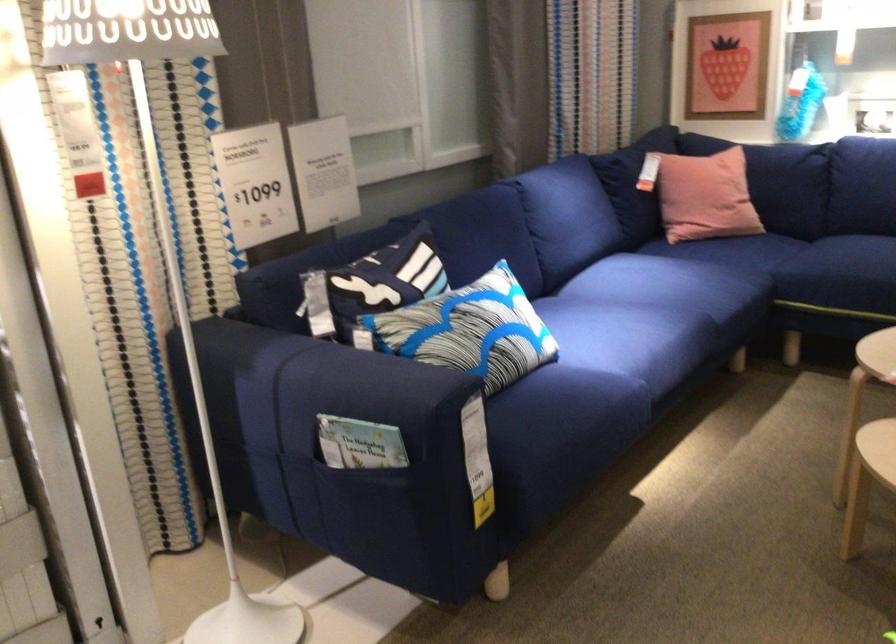
The image size is (896, 644). I want to click on sofa sitting surface, so click(x=676, y=303).